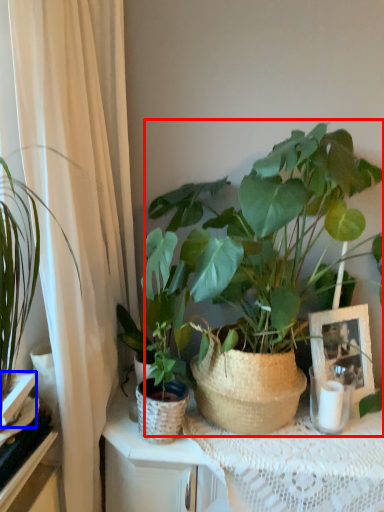
Question: Which point is further to the camera, houseplant (highlighted by a red box) or shelf (highlighted by a blue box)?

Choices:
 (A) houseplant
 (B) shelf

Answer: (B)